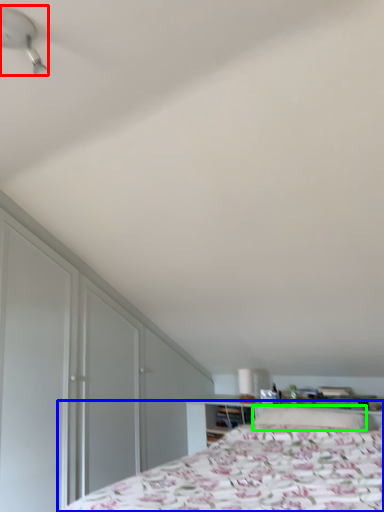
Question: Considering the real-world distances, which object is closest to fan (highlighted by a red box)? bed (highlighted by a blue box) or pillow (highlighted by a green box).

Choices:
 (A) bed
 (B) pillow

Answer: (A)